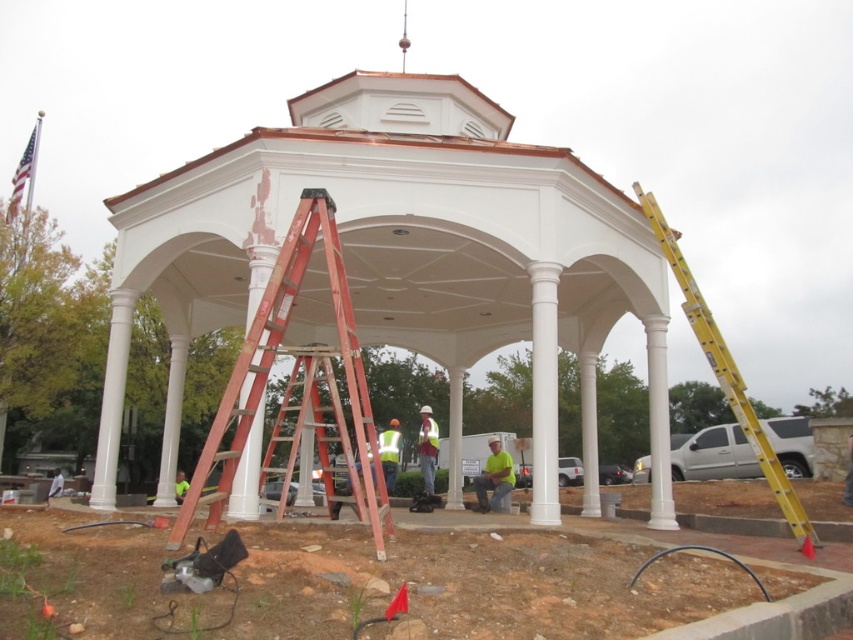
Can you confirm if yellow metallic ladder at right is positioned above green fabric shirt at center?

Yes.

Is yellow metallic ladder at right smaller than green fabric shirt at center?

Actually, yellow metallic ladder at right might be larger than green fabric shirt at center.

Locate an element on the screen. The image size is (853, 640). yellow metallic ladder at right is located at coordinates (727, 374).

Is reflective silver helmet at center smaller than reflective yellow safety vest at center?

Yes.

Is point (433, 451) positioned after point (395, 456)?

Yes, point (433, 451) is behind point (395, 456).

In order to click on reflective silver helmet at center in this screenshot , I will do `click(427, 449)`.

Does yellow metallic ladder at right come in front of reflective silver helmet at center?

That is True.

Who is positioned more to the left, yellow metallic ladder at right or reflective silver helmet at center?

Positioned to the left is reflective silver helmet at center.

Where is `yellow metallic ladder at right`? yellow metallic ladder at right is located at coordinates (727, 374).

You are a GUI agent. You are given a task and a screenshot of the screen. Output one action in this format:
    pyautogui.click(x=<x>, y=<y>)
    Task: Click on the yellow metallic ladder at right
    The width and height of the screenshot is (853, 640).
    Given the screenshot: What is the action you would take?
    727,374